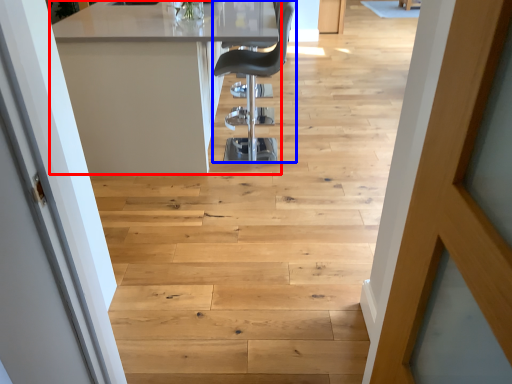
Question: Which object is further to the camera taking this photo, table (highlighted by a red box) or chair (highlighted by a blue box)?

Choices:
 (A) table
 (B) chair

Answer: (B)